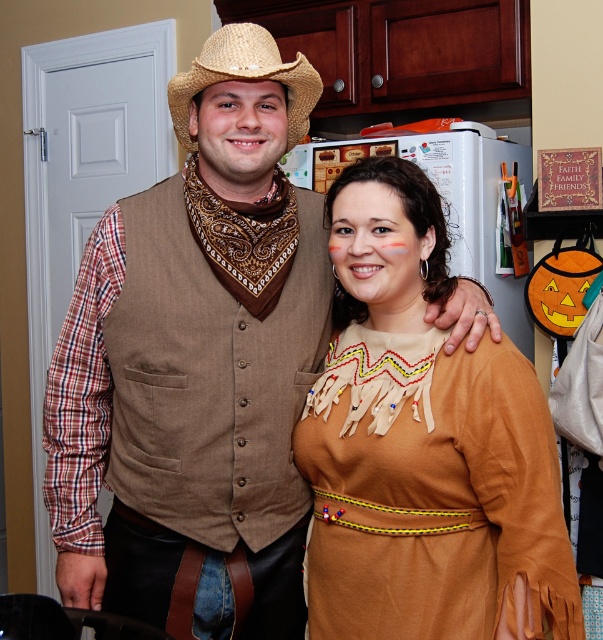
You are a photographer trying to capture a group photo of the two people in the kitchen. The camera you are using has a minimum focus distance of 10 inches. Can you take a photo of both the brown woven vest at center and the brown leather dress at center without moving either of them?

The distance between the brown woven vest at center and the brown leather dress at center is 8.96 inches, which is less than the camera minimum focus distance of 10 inches. Therefore, the camera cannot focus on both subjects simultaneously without moving them closer together.

You are trying to decide which costume to wear for a party. You have two options in front of you. The first is the brown woven vest at center, and the second is the brown leather dress at center. If you want to choose the one that covers more of your body, which should you pick?

The brown woven vest at center is larger in size than the brown leather dress at center, so you should choose the brown woven vest at center as it covers more of your body.